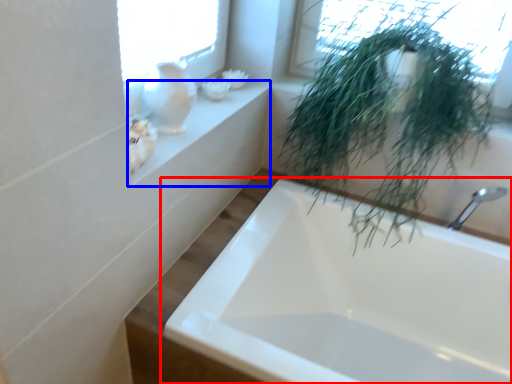
Question: Which object is further to the camera taking this photo, bathtub (highlighted by a red box) or window sill (highlighted by a blue box)?

Choices:
 (A) bathtub
 (B) window sill

Answer: (B)